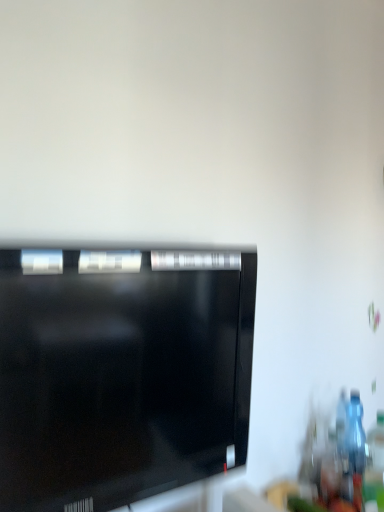
Question: Considering the relative sizes of black glossy television at center and transparent plastic bottle at right in the image provided, is black glossy television at center smaller than transparent plastic bottle at right?

Choices:
 (A) yes
 (B) no

Answer: (B)

Question: Is black glossy television at center bigger than transparent plastic bottle at right?

Choices:
 (A) yes
 (B) no

Answer: (A)

Question: Does black glossy television at center appear on the left side of transparent plastic bottle at right?

Choices:
 (A) no
 (B) yes

Answer: (B)

Question: Is the position of black glossy television at center more distant than that of transparent plastic bottle at right?

Choices:
 (A) yes
 (B) no

Answer: (B)

Question: Is black glossy television at center beside transparent plastic bottle at right?

Choices:
 (A) no
 (B) yes

Answer: (A)

Question: Is black glossy television at center not near transparent plastic bottle at right?

Choices:
 (A) no
 (B) yes

Answer: (A)

Question: From a real-world perspective, is transparent plastic bottle at right positioned over black glossy television at center based on gravity?

Choices:
 (A) no
 (B) yes

Answer: (A)

Question: From the image's perspective, is transparent plastic bottle at right on black glossy television at center?

Choices:
 (A) no
 (B) yes

Answer: (A)

Question: Can you confirm if transparent plastic bottle at right is positioned to the left of black glossy television at center?

Choices:
 (A) no
 (B) yes

Answer: (A)

Question: Does transparent plastic bottle at right have a larger size compared to black glossy television at center?

Choices:
 (A) no
 (B) yes

Answer: (A)

Question: Is transparent plastic bottle at right located outside black glossy television at center?

Choices:
 (A) yes
 (B) no

Answer: (A)

Question: Is transparent plastic bottle at right shorter than black glossy television at center?

Choices:
 (A) yes
 (B) no

Answer: (A)

Question: Considering the positions of transparent plastic bottle at right and black glossy television at center in the image, is transparent plastic bottle at right wider or thinner than black glossy television at center?

Choices:
 (A) wide
 (B) thin

Answer: (B)